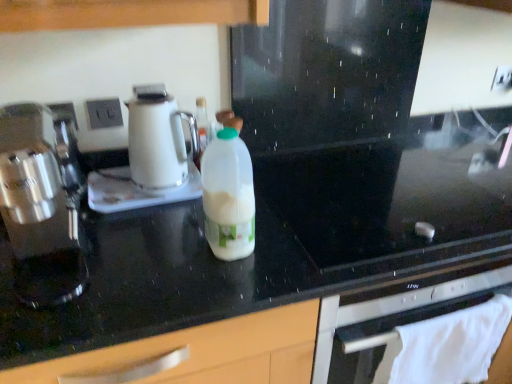
Identify the location of vacant region to the left of white plastic bottle at center. (154, 244).